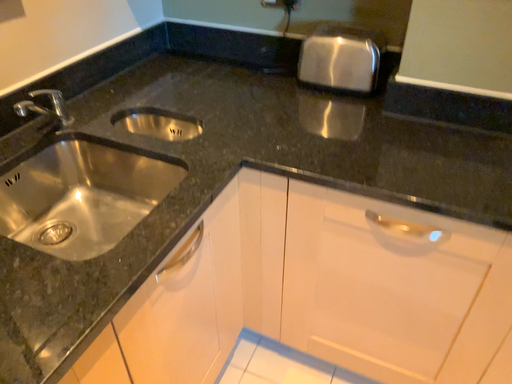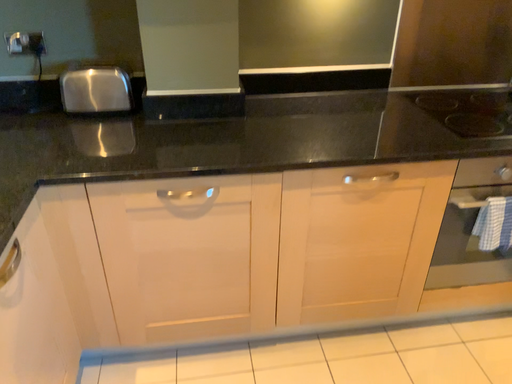
Question: Which way did the camera rotate in the video?

Choices:
 (A) rotated downward
 (B) rotated upward

Answer: (B)